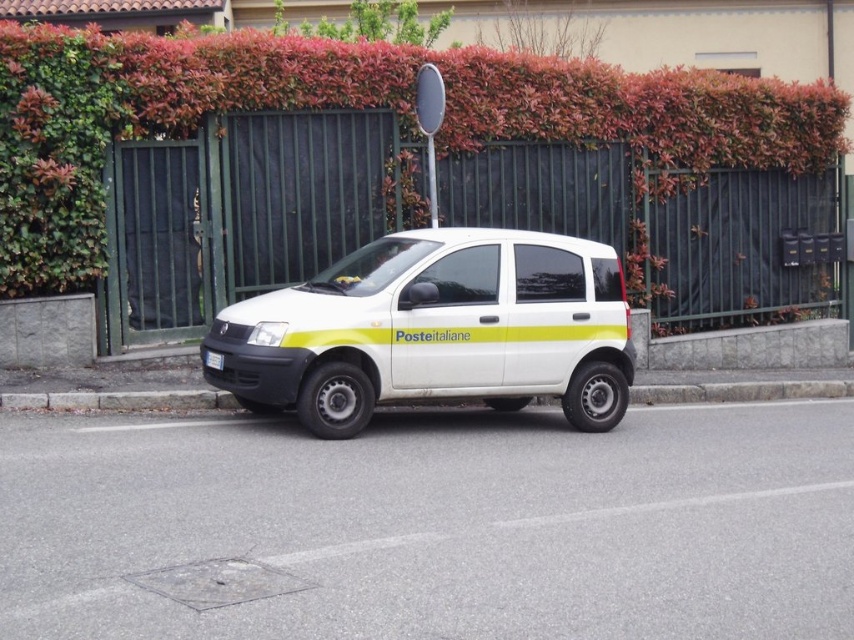
You are a delivery driver who needs to park your van exactly at the gray concrete curb at lower center. Based on the scene description, can you confirm the exact coordinates where the curb is located?

The gray concrete curb at lower center is located at point (120, 401), so you should park your van at those coordinates to align with the curb.

You are a delivery driver who needs to turn left onto a narrow alley. You see the green leafy hedge at upper center and the white matte van at center. Which object is closer to the left side of the road?

The white matte van at center is closer to the left side of the road since the green leafy hedge at upper center is positioned to its right.